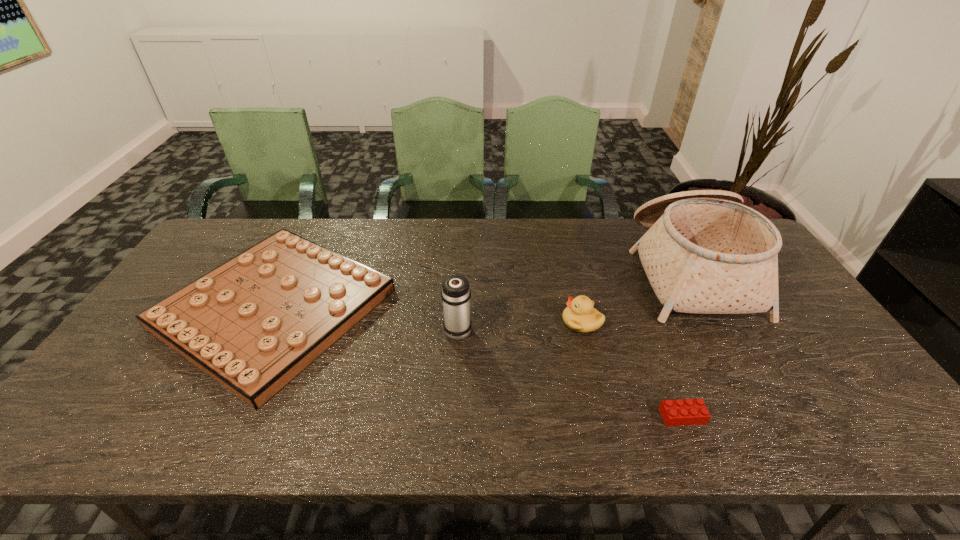
Where is `vacant area that satisfies the following two spatial constraints: 1. with the lid open on the tallest object; 2. on the front side of the Lego`? The width and height of the screenshot is (960, 540). vacant area that satisfies the following two spatial constraints: 1. with the lid open on the tallest object; 2. on the front side of the Lego is located at coordinates (769, 416).

The image size is (960, 540). Find the location of `vacant point that satisfies the following two spatial constraints: 1. on the beak of the third shortest object; 2. on the back side of the shortest object`. vacant point that satisfies the following two spatial constraints: 1. on the beak of the third shortest object; 2. on the back side of the shortest object is located at coordinates (604, 416).